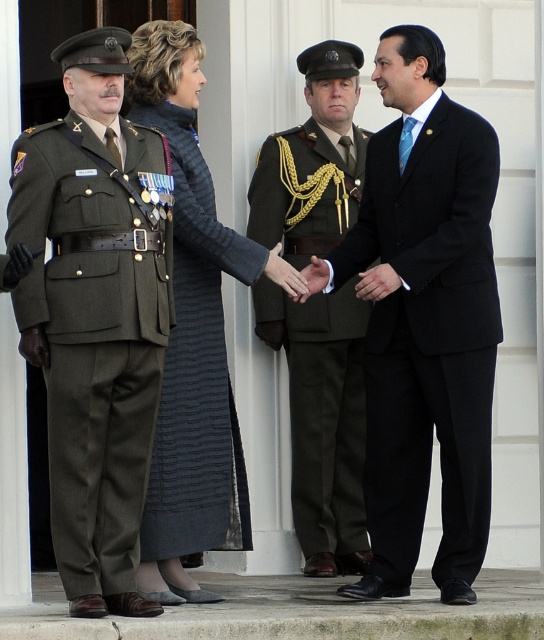
Question: Among these points, which one is nearest to the camera?

Choices:
 (A) pos(34,282)
 (B) pos(441,470)
 (C) pos(218,477)
 (D) pos(272,317)

Answer: (A)

Question: Can you confirm if black satin suit at center is positioned below green military uniform at center?

Choices:
 (A) no
 (B) yes

Answer: (A)

Question: Which point appears farthest from the camera in this image?

Choices:
 (A) (152, 333)
 (B) (196, 372)
 (C) (367, 304)

Answer: (C)

Question: Does black satin suit at center come behind green fabric uniform at left?

Choices:
 (A) no
 (B) yes

Answer: (B)

Question: Which object is positioned closest to the green fabric uniform at left?

Choices:
 (A) green military uniform at center
 (B) black satin suit at center

Answer: (B)

Question: Can you confirm if green fabric uniform at left is positioned to the right of green military uniform at center?

Choices:
 (A) yes
 (B) no

Answer: (B)